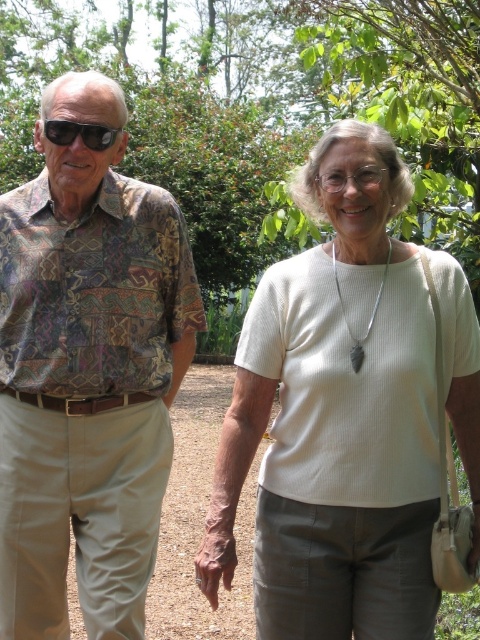
You are a photographer standing in a garden and see the white ribbed shirt at center. If you want to take a closeup photo of the shirt, do you need to move closer or further away?

The white ribbed shirt at center is 2.34 meters from viewer. To take a closeup photo, you need to move closer to reduce the distance between yourself and the shirt.

You are a photographer trying to capture a candid shot of both the white ribbed shirt at center and the black plastic sunglasses at left. Based on their positions, which object should you focus on first to ensure both are in frame?

The white ribbed shirt at center is positioned on the right side of black plastic sunglasses at left, so you should focus on the black plastic sunglasses at left first to ensure both are in frame.

You are a photographer setting up a shot in the garden. You notice the printed fabric shirt at left and the black plastic sunglasses at left. Which object should you focus on if you want to capture something taller in the scene?

The printed fabric shirt at left is much taller than the black plastic sunglasses at left, so you should focus on the printed fabric shirt at left to capture something taller in the scene.